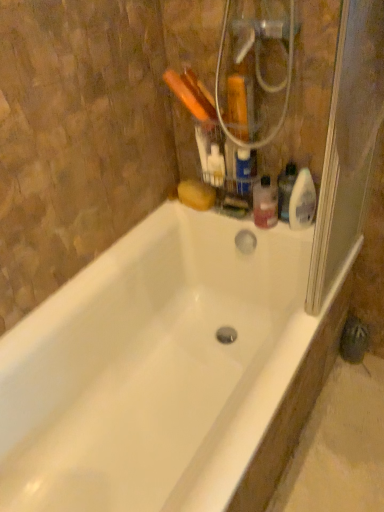
This screenshot has width=384, height=512. What are the coordinates of `translucent plastic bottle at upper right, the second cleaning product from the right` in the screenshot? It's located at (286, 189).

Describe the element at coordinates (348, 143) in the screenshot. I see `transparent plastic screen door at right` at that location.

Identify the location of white plastic toothbrushes at upper center, the third cleaning product when ordered from right to left. (215, 166).

Considering the sizes of transparent plastic screen door at right and white plastic toothbrushes at upper center, the third cleaning product when ordered from right to left, in the image, is transparent plastic screen door at right bigger or smaller than white plastic toothbrushes at upper center, the third cleaning product when ordered from right to left,?

Considering their sizes, transparent plastic screen door at right takes up more space than white plastic toothbrushes at upper center, the third cleaning product when ordered from right to left.

Is transparent plastic screen door at right inside or outside of white plastic toothbrushes at upper center, the third cleaning product when ordered from right to left?

transparent plastic screen door at right is spatially situated outside white plastic toothbrushes at upper center, the third cleaning product when ordered from right to left.

Is transparent plastic screen door at right aimed at white plastic toothbrushes at upper center, the third cleaning product when ordered from right to left?

No, transparent plastic screen door at right is not oriented towards white plastic toothbrushes at upper center, the third cleaning product when ordered from right to left.

Is point (272, 219) behind point (307, 287)?

That is True.

Considering the relative sizes of translucent plastic bottle at upper right and transparent plastic screen door at right in the image provided, is translucent plastic bottle at upper right wider than transparent plastic screen door at right?

Yes, translucent plastic bottle at upper right is wider than transparent plastic screen door at right.

Considering the positions of objects translucent plastic bottle at upper right and transparent plastic screen door at right in the image provided, who is behind, translucent plastic bottle at upper right or transparent plastic screen door at right?

translucent plastic bottle at upper right is further from the camera.

Is translucent plastic bottle at upper right completely or partially outside of transparent plastic screen door at right?

translucent plastic bottle at upper right is positioned outside transparent plastic screen door at right.

This screenshot has width=384, height=512. In the image, there is a translucent plastic bottle at upper right, the second cleaning product from the right. In order to click on screen door above it (from the image's perspective) in this screenshot , I will do `click(348, 143)`.

Can you confirm if transparent plastic screen door at right is bigger than translucent plastic bottle at upper right, the second cleaning product from the right?

Correct, transparent plastic screen door at right is larger in size than translucent plastic bottle at upper right, the second cleaning product from the right.

Does transparent plastic screen door at right appear on the right side of translucent plastic bottle at upper right, arranged as the second cleaning product when viewed from the left?

Indeed, transparent plastic screen door at right is positioned on the right side of translucent plastic bottle at upper right, arranged as the second cleaning product when viewed from the left.

From a real-world perspective, is white glossy bathtub at center located higher than transparent plastic screen door at right?

Incorrect, from a real-world perspective, white glossy bathtub at center is lower than transparent plastic screen door at right.

From the image's perspective, is white glossy bathtub at center under transparent plastic screen door at right?

Correct, white glossy bathtub at center appears lower than transparent plastic screen door at right in the image.

Between white glossy bathtub at center and transparent plastic screen door at right, which one has larger width?

Wider between the two is white glossy bathtub at center.

Looking at this image, is white glossy bathtub at center oriented towards transparent plastic screen door at right?

No.

Is white glossy bathtub at center facing away from white plastic toothbrushes at upper center, the third cleaning product when ordered from right to left?

No, white plastic toothbrushes at upper center, the third cleaning product when ordered from right to left, is not at the back of white glossy bathtub at center.

Do you think white glossy bathtub at center is within white plastic toothbrushes at upper center, the 1th cleaning product in the left-to-right sequence, or outside of it?

white glossy bathtub at center is spatially situated outside white plastic toothbrushes at upper center, the 1th cleaning product in the left-to-right sequence.

Between white glossy bathtub at center and white plastic toothbrushes at upper center, the third cleaning product when ordered from right to left, which one appears on the right side from the viewer's perspective?

white plastic toothbrushes at upper center, the third cleaning product when ordered from right to left.

From a real-world perspective, who is located lower, white glossy bathtub at center or translucent plastic bottle at upper right?

white glossy bathtub at center is physically lower.

The height and width of the screenshot is (512, 384). In the image, there is a translucent plastic bottle at upper right. In order to click on bathtub below it (from a real-world perspective) in this screenshot , I will do `click(155, 368)`.

Consider the image. Which object is further away from the camera, white glossy bathtub at center or translucent plastic bottle at upper right?

translucent plastic bottle at upper right is behind.

Can you confirm if white glossy bathtub at center is smaller than translucent plastic bottle at upper right?

Incorrect, white glossy bathtub at center is not smaller in size than translucent plastic bottle at upper right.

Is point (310, 192) in front of point (255, 223)?

Yes.

Does translucent plastic spray bottle at upper right, the 3th cleaning product in the left-to-right sequence, have a greater width compared to translucent plastic bottle at upper right?

Incorrect, the width of translucent plastic spray bottle at upper right, the 3th cleaning product in the left-to-right sequence, does not surpass that of translucent plastic bottle at upper right.

Looking at this image, is translucent plastic spray bottle at upper right, the 1th cleaning product positioned from the right, facing towards translucent plastic bottle at upper right?

No, translucent plastic spray bottle at upper right, the 1th cleaning product positioned from the right, is not oriented towards translucent plastic bottle at upper right.

Is translucent plastic spray bottle at upper right, the 3th cleaning product in the left-to-right sequence, to the left of translucent plastic bottle at upper right from the viewer's perspective?

Incorrect, translucent plastic spray bottle at upper right, the 3th cleaning product in the left-to-right sequence, is not on the left side of translucent plastic bottle at upper right.

I want to click on screen door above the white plastic toothbrushes at upper center, the third cleaning product when ordered from right to left (from a real-world perspective), so (348, 143).

The width and height of the screenshot is (384, 512). In order to click on screen door on the right of translucent plastic bottle at upper right in this screenshot , I will do `click(348, 143)`.

When comparing their distances from translucent plastic bottle at upper right, arranged as the second cleaning product when viewed from the left, does translucent plastic spray bottle at upper right, the 3th cleaning product in the left-to-right sequence, or white glossy bathtub at center seem closer?

translucent plastic spray bottle at upper right, the 3th cleaning product in the left-to-right sequence, is positioned closer to the anchor translucent plastic bottle at upper right, arranged as the second cleaning product when viewed from the left.

When comparing their distances from white plastic toothbrushes at upper center, the third cleaning product when ordered from right to left, does translucent plastic bottle at upper right or white glossy bathtub at center seem closer?

Based on the image, translucent plastic bottle at upper right appears to be nearer to white plastic toothbrushes at upper center, the third cleaning product when ordered from right to left.

Consider the image. When comparing their distances from transparent plastic screen door at right, does translucent plastic bottle at upper right or white glossy bathtub at center seem further?

Based on the image, white glossy bathtub at center appears to be further to transparent plastic screen door at right.

In the scene shown: Which object lies nearer to the anchor point translucent plastic bottle at upper right, white glossy bathtub at center or white plastic toothbrushes at upper center, the third cleaning product when ordered from right to left?

The object closer to translucent plastic bottle at upper right is white plastic toothbrushes at upper center, the third cleaning product when ordered from right to left.

From the image, which object appears to be nearer to translucent plastic bottle at upper right, white plastic toothbrushes at upper center, the third cleaning product when ordered from right to left, or translucent plastic bottle at upper right, arranged as the second cleaning product when viewed from the left?

Among the two, translucent plastic bottle at upper right, arranged as the second cleaning product when viewed from the left, is located nearer to translucent plastic bottle at upper right.

When comparing their distances from white glossy bathtub at center, does translucent plastic bottle at upper right, arranged as the second cleaning product when viewed from the left, or white plastic toothbrushes at upper center, the 1th cleaning product in the left-to-right sequence, seem further?

translucent plastic bottle at upper right, arranged as the second cleaning product when viewed from the left, is further to white glossy bathtub at center.

Looking at the image, which one is located further to transparent plastic screen door at right, translucent plastic bottle at upper right or white plastic toothbrushes at upper center, the 1th cleaning product in the left-to-right sequence?

Based on the image, white plastic toothbrushes at upper center, the 1th cleaning product in the left-to-right sequence, appears to be further to transparent plastic screen door at right.

Based on the photo, considering their positions, is transparent plastic screen door at right positioned further to white glossy bathtub at center than translucent plastic bottle at upper right?

The object further to white glossy bathtub at center is transparent plastic screen door at right.

Where is `toiletry between white plastic toothbrushes at upper center, the third cleaning product when ordered from right to left, and translucent plastic bottle at upper right, arranged as the second cleaning product when viewed from the left, from left to right`? toiletry between white plastic toothbrushes at upper center, the third cleaning product when ordered from right to left, and translucent plastic bottle at upper right, arranged as the second cleaning product when viewed from the left, from left to right is located at coordinates (265, 203).

Image resolution: width=384 pixels, height=512 pixels. What are the coordinates of `screen door positioned between white glossy bathtub at center and white plastic toothbrushes at upper center, the 1th cleaning product in the left-to-right sequence, from near to far` in the screenshot? It's located at (x=348, y=143).

At what (x,y) coordinates should I click in order to perform the action: click on screen door between white glossy bathtub at center and translucent plastic bottle at upper right from front to back. Please return your answer as a coordinate pair (x, y). Looking at the image, I should click on (348, 143).

Find the location of a particular element. The width and height of the screenshot is (384, 512). cleaning product located between white plastic toothbrushes at upper center, the 1th cleaning product in the left-to-right sequence, and translucent plastic spray bottle at upper right, the 1th cleaning product positioned from the right, in the left-right direction is located at coordinates (286, 189).